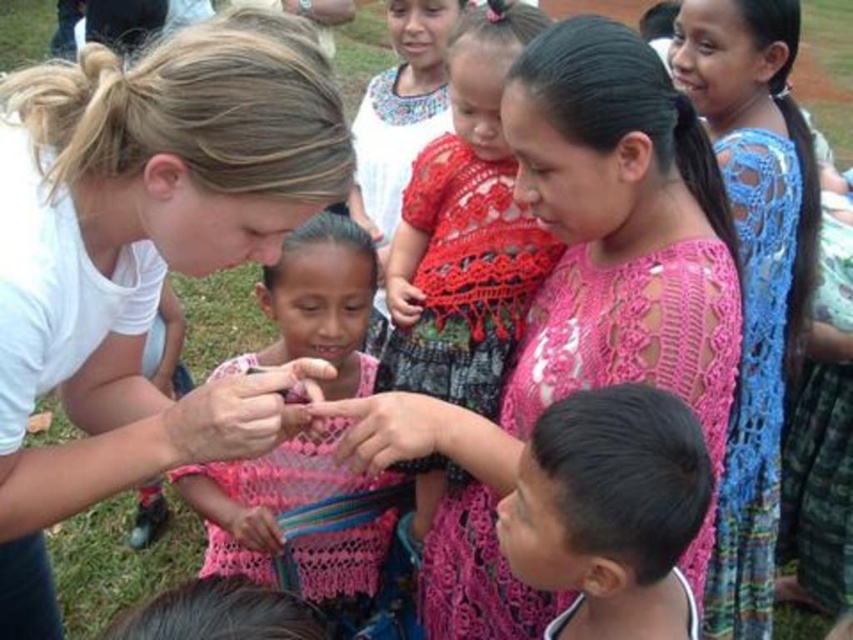
You are a fashion designer who wants to create a new collection featuring both the pink crochet dress at center and the pink knitted sweater at center. Based on their sizes, which one would be more suitable for a child aged 5 years old?

The pink knitted sweater at center would be more suitable for a child aged 5 years old since it has a smaller size compared to the pink crochet dress at center.

You are a photographer trying to capture a candid shot of the two women and the girl. You notice the blue crochet dress at upper right and the pink knitted sweater at center. Which object should you focus on first if you want to capture the main subject in the center of the image?

The pink knitted sweater at center is the main subject located at the center of the image, so you should focus on it first to capture the main subject.

From the picture: You are a photographer trying to capture a candid shot of the red crochet dress at center without the white matte shirt at upper left blocking the view. Based on their positions, is this possible?

The white matte shirt at upper left is in front of the red crochet dress at center, so it would block the view. To capture the red crochet dress at center without obstruction, you would need to adjust your angle or move around the white matte shirt at upper left.